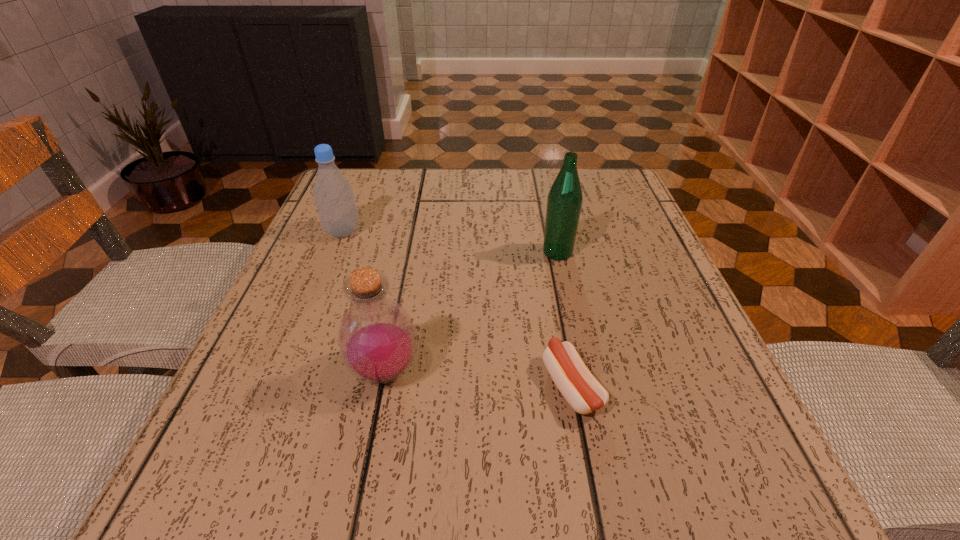
The height and width of the screenshot is (540, 960). Find the location of `vacant space positioned on the front of the shortest object`. vacant space positioned on the front of the shortest object is located at coordinates (585, 457).

The height and width of the screenshot is (540, 960). What are the coordinates of `object that is at the left edge` in the screenshot? It's located at (333, 194).

Identify the location of free spot at the far edge of the desktop. The image size is (960, 540). (538, 180).

This screenshot has width=960, height=540. What are the coordinates of `blank area at the near edge` in the screenshot? It's located at (526, 458).

This screenshot has width=960, height=540. In the image, there is a desktop. Find the location of `vacant space at the left edge`. vacant space at the left edge is located at coordinates (272, 348).

In the image, there is a desktop. At what (x,y) coordinates should I click in order to perform the action: click on vacant space at the right edge. Please return your answer as a coordinate pair (x, y). Looking at the image, I should click on (608, 317).

What are the coordinates of `vacant position at the far left corner of the desktop` in the screenshot? It's located at (383, 177).

Find the location of a particular element. vacant space at the far right corner is located at coordinates (599, 179).

Find the location of a particular element. blank space at the near right corner of the desktop is located at coordinates click(x=729, y=460).

This screenshot has height=540, width=960. I want to click on vacant space in between the second farthest bottle and the sausage, so click(564, 319).